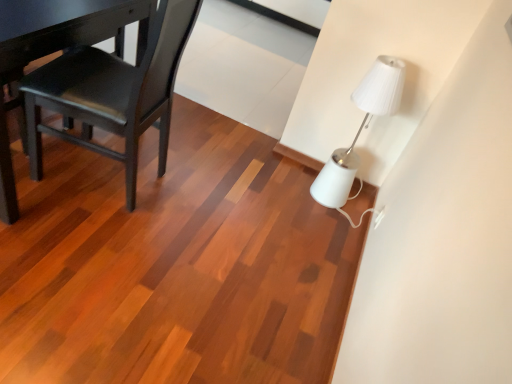
Question: From the image's perspective, would you say matte black chair at left is shown under white plastic electric outlet at lower right?

Choices:
 (A) no
 (B) yes

Answer: (A)

Question: From a real-world perspective, is matte black chair at left under white plastic electric outlet at lower right?

Choices:
 (A) no
 (B) yes

Answer: (A)

Question: Could you tell me if matte black chair at left is facing white plastic electric outlet at lower right?

Choices:
 (A) yes
 (B) no

Answer: (B)

Question: Is matte black chair at left closer to the viewer compared to white plastic electric outlet at lower right?

Choices:
 (A) no
 (B) yes

Answer: (B)

Question: Is white plastic electric outlet at lower right a part of matte black chair at left?

Choices:
 (A) yes
 (B) no

Answer: (B)

Question: Is white plastic electric outlet at lower right in front of or behind matte black chair at left in the image?

Choices:
 (A) front
 (B) behind

Answer: (B)

Question: Looking at their shapes, would you say white plastic electric outlet at lower right is wider or thinner than matte black chair at left?

Choices:
 (A) thin
 (B) wide

Answer: (A)

Question: Would you say white plastic electric outlet at lower right is inside or outside matte black chair at left?

Choices:
 (A) inside
 (B) outside

Answer: (B)

Question: Visually, is white plastic electric outlet at lower right positioned to the left or to the right of matte black chair at left?

Choices:
 (A) left
 (B) right

Answer: (B)

Question: Would you say white glossy lamp at upper right is to the left or to the right of matte black chair at left in the picture?

Choices:
 (A) left
 (B) right

Answer: (B)

Question: Considering the positions of white glossy lamp at upper right and matte black chair at left in the image, is white glossy lamp at upper right bigger or smaller than matte black chair at left?

Choices:
 (A) small
 (B) big

Answer: (A)

Question: Relative to matte black chair at left, is white glossy lamp at upper right in front or behind?

Choices:
 (A) behind
 (B) front

Answer: (A)

Question: From the image's perspective, relative to matte black chair at left, is white glossy lamp at upper right above or below?

Choices:
 (A) above
 (B) below

Answer: (B)

Question: Is point (71, 114) closer or farther from the camera than point (375, 215)?

Choices:
 (A) farther
 (B) closer

Answer: (B)

Question: Would you say matte black chair at left is to the left or to the right of white plastic electric outlet at lower right in the picture?

Choices:
 (A) right
 (B) left

Answer: (B)